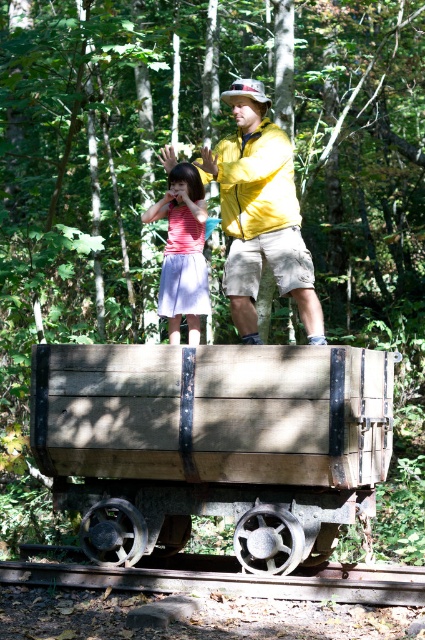
Question: Which of the following is the closest to the observer?

Choices:
 (A) pink fabric skirt at center
 (B) brown wooden train track at bottom

Answer: (B)

Question: In this image, where is wooden wagon at center located relative to brown wooden train track at bottom?

Choices:
 (A) right
 (B) left

Answer: (A)

Question: Which point is farther from the camera taking this photo?

Choices:
 (A) (71, 572)
 (B) (283, 522)

Answer: (A)

Question: Considering the relative positions of wooden wagon at center and pink fabric skirt at center in the image provided, where is wooden wagon at center located with respect to pink fabric skirt at center?

Choices:
 (A) right
 (B) left

Answer: (A)

Question: Which of the following is the closest to the observer?

Choices:
 (A) (76, 490)
 (B) (274, 576)
 (C) (243, 209)
 (D) (181, 266)

Answer: (B)

Question: Observing the image, what is the correct spatial positioning of wooden wagon at center in reference to yellow matte jacket at upper center?

Choices:
 (A) above
 (B) below

Answer: (B)